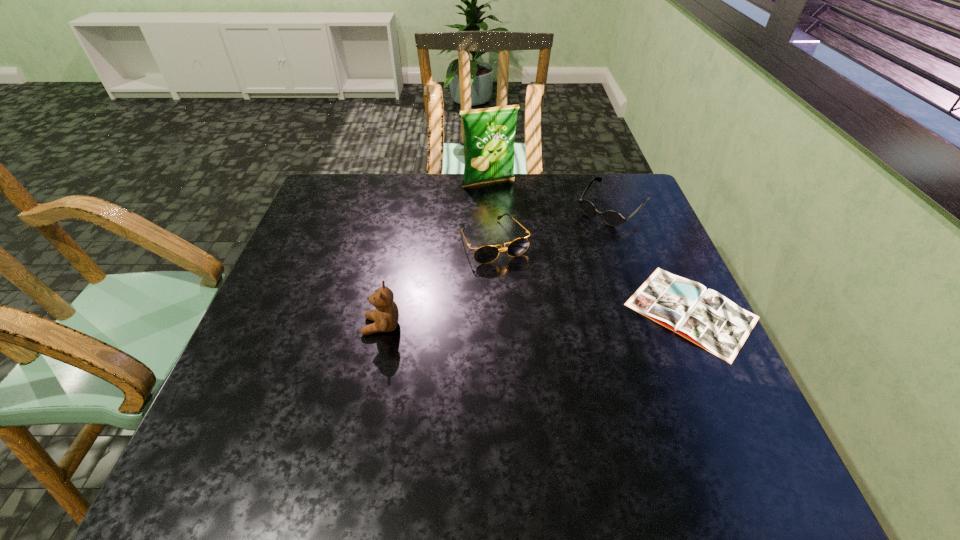
Image resolution: width=960 pixels, height=540 pixels. I want to click on vacant spot on the desktop that is between the leftmost object and the book and is positioned on the lenses of the right sunglasses, so click(x=500, y=320).

This screenshot has height=540, width=960. Identify the location of free space on the desktop that is between the teddy bear and the book and is positioned on the front-facing side of the tallest object. (564, 317).

At what (x,y) coordinates should I click in order to perform the action: click on vacant spot on the desktop that is between the teddy bear and the book and is positioned on the front-facing side of the left sunglasses. Please return your answer as a coordinate pair (x, y). The height and width of the screenshot is (540, 960). Looking at the image, I should click on (539, 319).